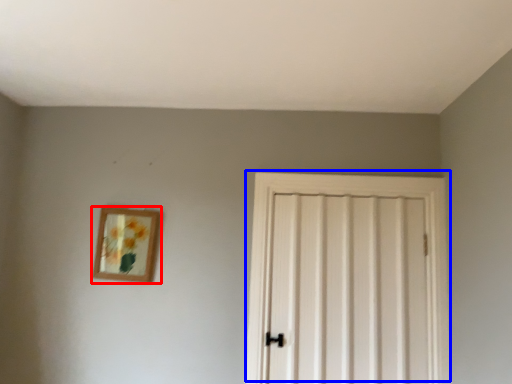
Question: Which point is closer to the camera, picture frame (highlighted by a red box) or door (highlighted by a blue box)?

Choices:
 (A) picture frame
 (B) door

Answer: (B)